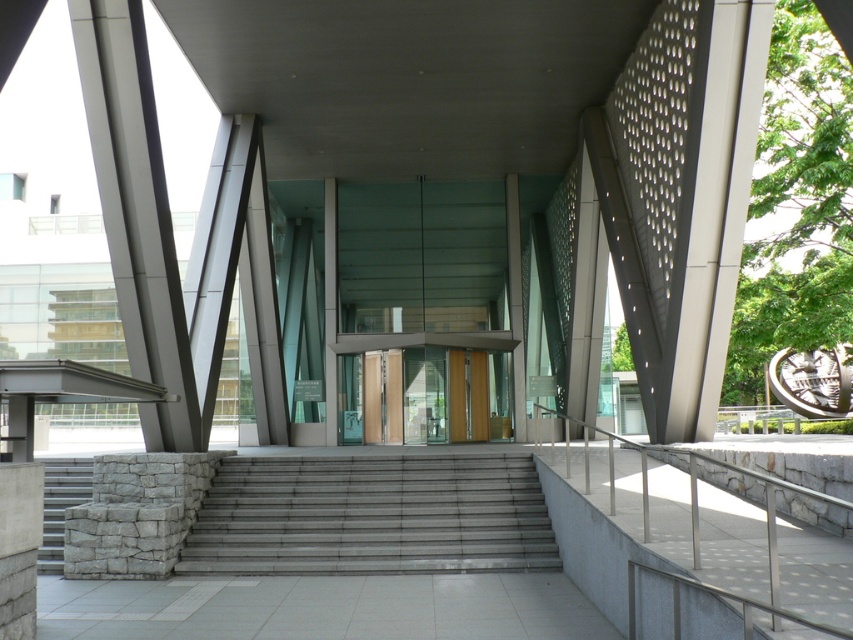
You are standing at the entrance of the modern building and notice two points marked on the glass facade. The first point is at coordinate (668,548) and the second is at (129,262). Which of these points is nearer to your current position?

Point (668,548) is closer to the viewer than point (129,262).

You are standing at the entrance of the modern building and want to locate the main entrance doors. According to the coordinates provided, where should you look to find the translucent glass doors at center?

The translucent glass doors at center are located at the coordinates point (x=434, y=394).